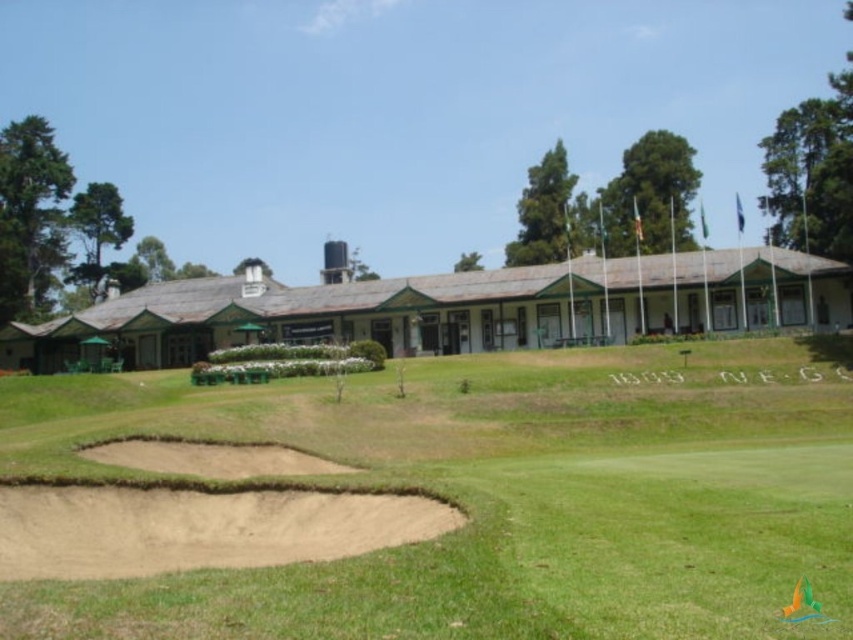
Is brown sand bunker at center to the left of sandy beige sand trap at lower left from the viewer's perspective?

Incorrect, brown sand bunker at center is not on the left side of sandy beige sand trap at lower left.

Between brown sand bunker at center and sandy beige sand trap at lower left, which one appears on the right side from the viewer's perspective?

Positioned to the right is brown sand bunker at center.

Where is `brown sand bunker at center`? The height and width of the screenshot is (640, 853). brown sand bunker at center is located at coordinates point(451,307).

Consider the image. Is sandy beige sand trap at lower left thinner than brown sand bunker at lower left?

In fact, sandy beige sand trap at lower left might be wider than brown sand bunker at lower left.

At what (x,y) coordinates should I click in order to perform the action: click on sandy beige sand trap at lower left. Please return your answer as a coordinate pair (x, y). Looking at the image, I should click on (199, 529).

Where is `sandy beige sand trap at lower left`? sandy beige sand trap at lower left is located at coordinates (199, 529).

Does brown sand bunker at center appear on the right side of brown sand bunker at lower left?

Correct, you'll find brown sand bunker at center to the right of brown sand bunker at lower left.

At what (x,y) coordinates should I click in order to perform the action: click on brown sand bunker at center. Please return your answer as a coordinate pair (x, y). Looking at the image, I should click on (451, 307).

Between point (532, 284) and point (111, 451), which one is positioned in front?

Point (111, 451) is in front.

Identify the location of brown sand bunker at center. (x=451, y=307).